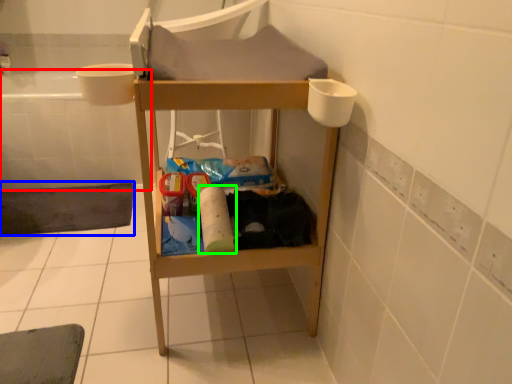
Question: Which is farther away from bath (highlighted by a red box)? bath mat (highlighted by a blue box) or toilet paper (highlighted by a green box)?

Choices:
 (A) bath mat
 (B) toilet paper

Answer: (B)